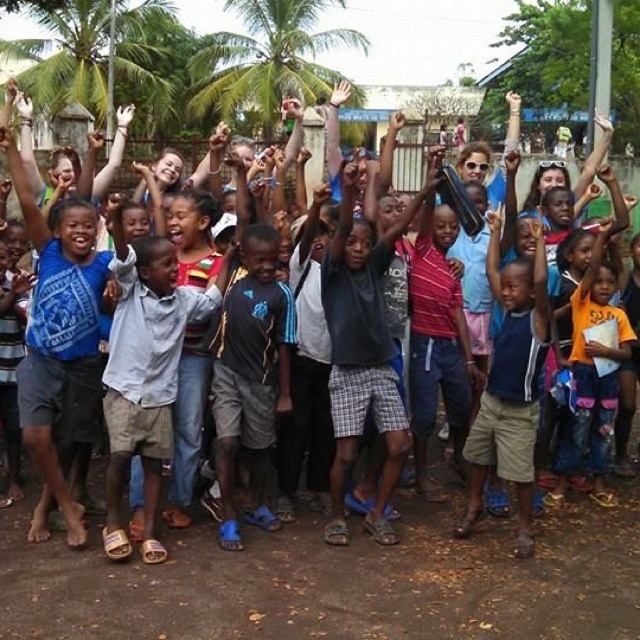
Question: Which point is closer to the camera taking this photo?

Choices:
 (A) (193, 58)
 (B) (186, 324)

Answer: (B)

Question: Which object appears farthest from the camera in this image?

Choices:
 (A) dark blue cotton shirt at center
 (B) light gray cotton shirt at center

Answer: (A)

Question: Is gray plaid shorts at center positioned behind green leafy palm tree at upper center?

Choices:
 (A) no
 (B) yes

Answer: (A)

Question: Can you confirm if dark gray shorts at center is positioned to the right of dark blue cotton shirt at center?

Choices:
 (A) yes
 (B) no

Answer: (B)

Question: Based on their relative distances, which object is nearer to the green leafy palm tree at upper left?

Choices:
 (A) gray plaid shorts at center
 (B) dark blue cotton shirt at center
 (C) light gray cotton shirt at center
 (D) green leafy palm tree at upper center

Answer: (D)

Question: Does dark blue cotton shirt at center appear on the right side of green leafy palm tree at upper center?

Choices:
 (A) no
 (B) yes

Answer: (B)